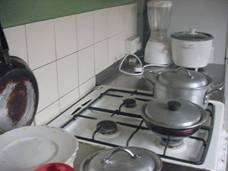
Identify the location of wall. (82, 24).